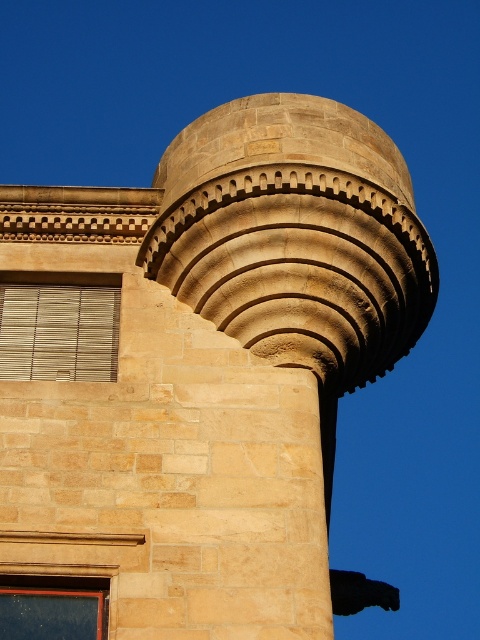
You are an architect evaluating the building facade. You notice the wooden slats at left and the matte wooden window at lower left. Which object would cast a bigger shadow if the sun is directly overhead?

The wooden slats at left would cast a bigger shadow because they have a larger size compared to the matte wooden window at lower left.

You are standing in front of the building and notice the wooden slats at left and the matte wooden window at lower left. Which object is closer to you?

The wooden slats at left are closer to you because they are positioned further to the viewer than the matte wooden window at lower left.